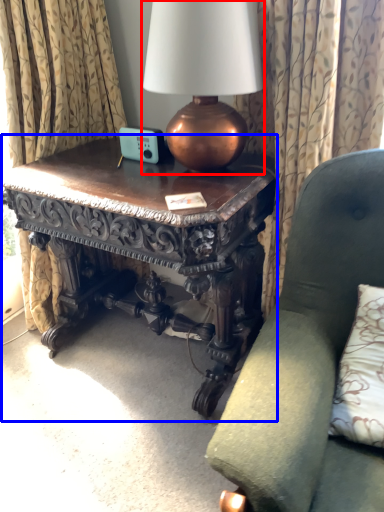
Question: Which of the following is the closest to the observer, lamp (highlighted by a red box) or table (highlighted by a blue box)?

Choices:
 (A) lamp
 (B) table

Answer: (A)